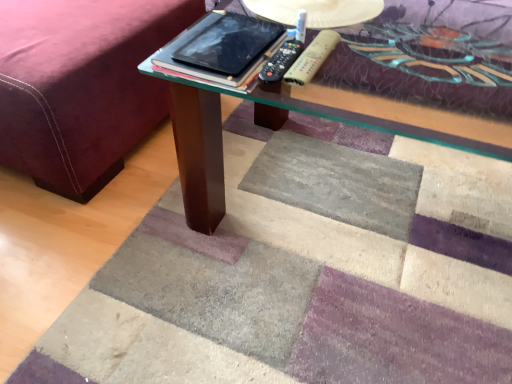
Question: Would you say black glossy tablet at center is to the left or to the right of velvet maroon bed frame at lower left in the picture?

Choices:
 (A) right
 (B) left

Answer: (A)

Question: Is black glossy tablet at center inside the boundaries of velvet maroon bed frame at lower left, or outside?

Choices:
 (A) outside
 (B) inside

Answer: (A)

Question: Estimate the real-world distances between objects in this image. Which object is closer to the black plastic remote at center, which appears as the 2th remote when viewed from the right?

Choices:
 (A) black glossy tablet at center
 (B) velvet maroon bed frame at lower left
 (C) wooden textured remote at center, the 1th remote from the right

Answer: (A)

Question: Estimate the real-world distances between objects in this image. Which object is farther from the black glossy tablet at center?

Choices:
 (A) wooden textured remote at center, the 1th remote from the right
 (B) black plastic remote at center, placed as the 1th remote when sorted from left to right
 (C) velvet maroon bed frame at lower left

Answer: (C)